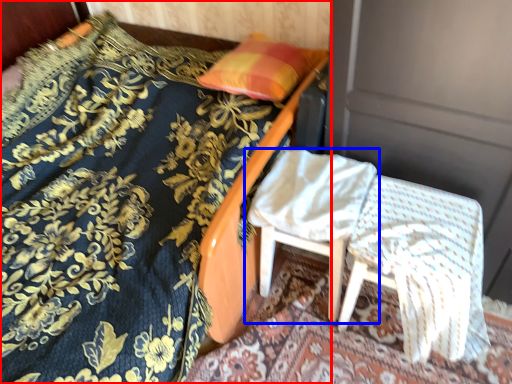
Question: Which point is further to the camera, bed (highlighted by a red box) or chair (highlighted by a blue box)?

Choices:
 (A) bed
 (B) chair

Answer: (B)